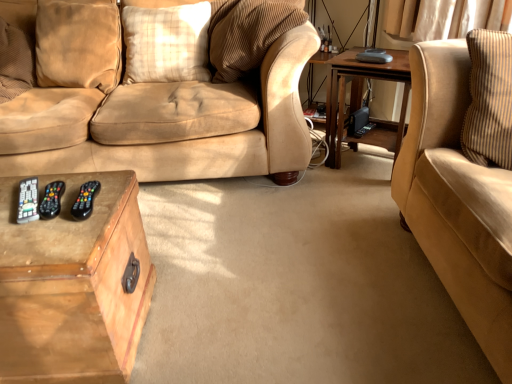
Identify the location of free point to the right of black plastic remote at lower left. This screenshot has width=512, height=384. (98, 200).